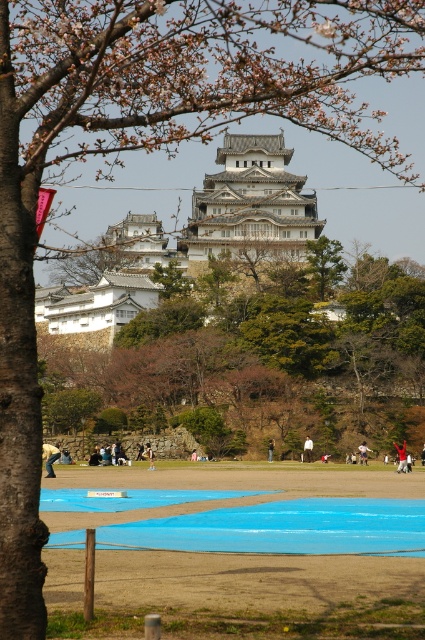
Is brown textured tree at center to the left of white cotton shirt at center from the viewer's perspective?

Correct, you'll find brown textured tree at center to the left of white cotton shirt at center.

Which is more to the right, brown textured tree at center or white cotton shirt at center?

white cotton shirt at center

This screenshot has width=425, height=640. What are the coordinates of `brown textured tree at center` in the screenshot? It's located at (260, 356).

Does point (333, 252) come closer to viewer compared to point (399, 456)?

No, it is not.

Does green textured tree at center lie in front of red fabric person at center?

No, green textured tree at center is further to the viewer.

Which is in front, point (316, 294) or point (399, 470)?

Point (399, 470) is in front.

Identify the location of green textured tree at center. (323, 266).

Can you confirm if light blue jeans at lower left is positioned to the right of red fabric person at center?

No, light blue jeans at lower left is not to the right of red fabric person at center.

Where is `light blue jeans at lower left`? The image size is (425, 640). light blue jeans at lower left is located at coordinates (50, 458).

I want to click on light blue jeans at lower left, so click(50, 458).